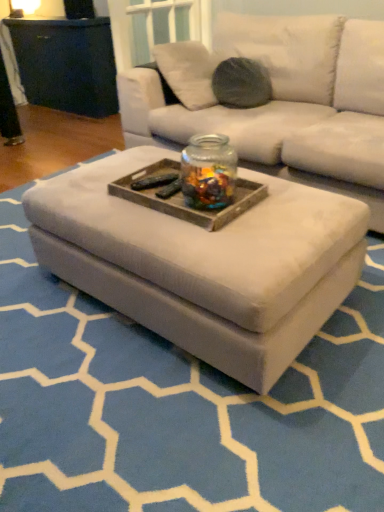
Question: Is transparent glass jar at center to the right of white fabric ottoman at center from the viewer's perspective?

Choices:
 (A) yes
 (B) no

Answer: (A)

Question: Is transparent glass jar at center behind white fabric ottoman at center?

Choices:
 (A) yes
 (B) no

Answer: (A)

Question: Could you tell me if transparent glass jar at center is turned towards white fabric ottoman at center?

Choices:
 (A) yes
 (B) no

Answer: (B)

Question: Is transparent glass jar at center to the left of white fabric ottoman at center from the viewer's perspective?

Choices:
 (A) yes
 (B) no

Answer: (B)

Question: From a real-world perspective, is transparent glass jar at center positioned under white fabric ottoman at center based on gravity?

Choices:
 (A) no
 (B) yes

Answer: (A)

Question: From the image's perspective, is wooden tray at center positioned above or below white fabric ottoman at center?

Choices:
 (A) above
 (B) below

Answer: (A)

Question: From a real-world perspective, is wooden tray at center above or below white fabric ottoman at center?

Choices:
 (A) above
 (B) below

Answer: (A)

Question: Is wooden tray at center inside the boundaries of white fabric ottoman at center, or outside?

Choices:
 (A) outside
 (B) inside

Answer: (A)

Question: Would you say wooden tray at center is to the left or to the right of white fabric ottoman at center in the picture?

Choices:
 (A) right
 (B) left

Answer: (A)

Question: Is wooden tray at center in front of or behind transparent glass jar at center in the image?

Choices:
 (A) behind
 (B) front

Answer: (A)

Question: Is wooden tray at center to the left or to the right of transparent glass jar at center in the image?

Choices:
 (A) right
 (B) left

Answer: (B)

Question: In terms of width, does wooden tray at center look wider or thinner when compared to transparent glass jar at center?

Choices:
 (A) wide
 (B) thin

Answer: (A)

Question: From a real-world perspective, is wooden tray at center positioned above or below transparent glass jar at center?

Choices:
 (A) below
 (B) above

Answer: (A)

Question: In the image, is white fabric ottoman at center positioned in front of or behind transparent glass jar at center?

Choices:
 (A) behind
 (B) front

Answer: (B)

Question: From a real-world perspective, is white fabric ottoman at center above or below transparent glass jar at center?

Choices:
 (A) above
 (B) below

Answer: (B)